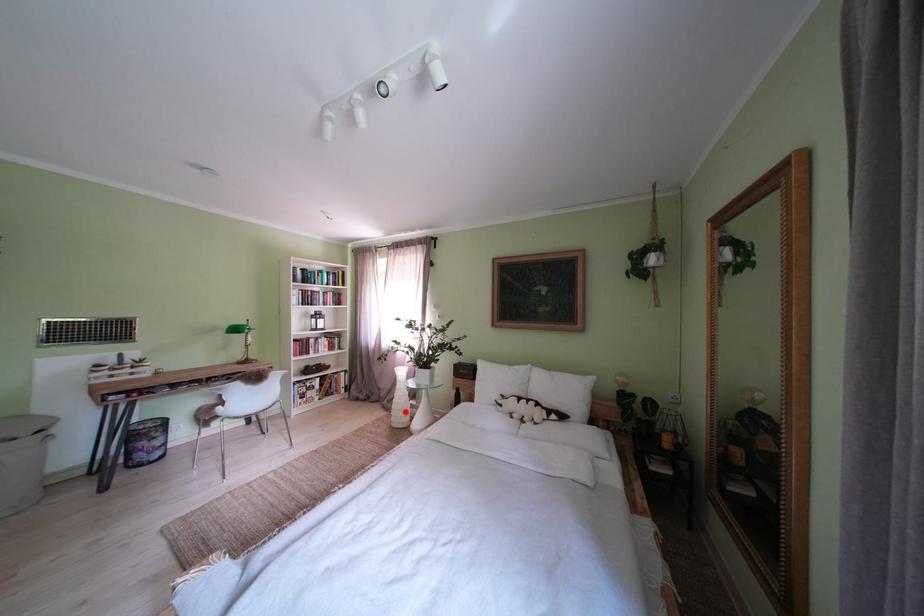
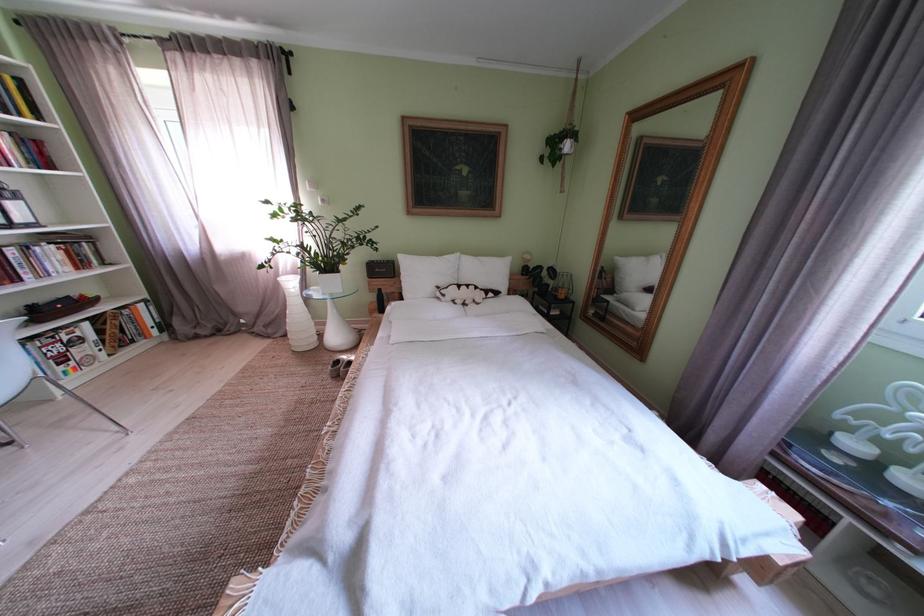
The point at the highlighted location is marked in the first image. Where is the corresponding point in the second image?

(301, 334)